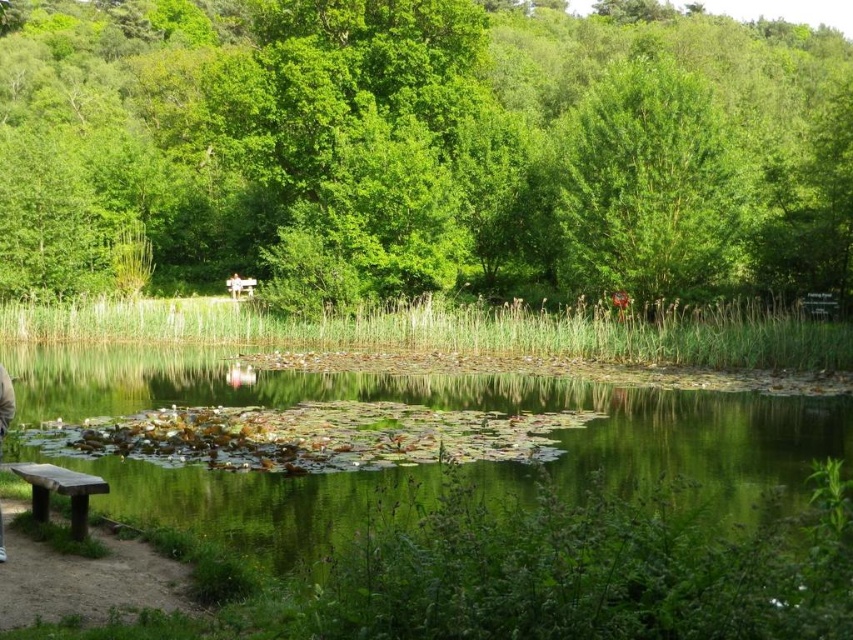
You are planning to host a small gathering in this serene natural setting. You need to seat 4 people comfortably. Which bench should you choose between the wooden bench at lower left and the wooden bench at center?

The wooden bench at lower left is larger in size than the wooden bench at center, so it can accommodate more people comfortably. Therefore, you should choose the wooden bench at lower left.

You are standing at the wooden bench on the dirt path and want to take a photo of the green leafy tree at center. Based on your current position, where should you aim your camera to capture the tree in the frame?

The green leafy tree at center is located at coordinates point (421,150), so you should aim your camera towards the lower left direction to capture it in the frame.

You are walking along the dirt path and see the green leafy tree at center and the light beige fabric jacket at lower left. Which object is closer to you?

The green leafy tree at center is closer to you since the light beige fabric jacket at lower left is behind it.